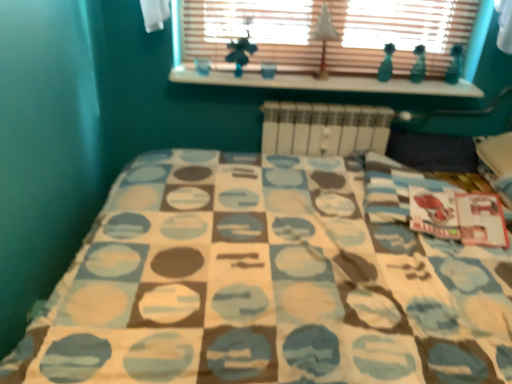
Question: Is white matte radiator at center shorter than white paper tree at upper center?

Choices:
 (A) yes
 (B) no

Answer: (B)

Question: From the image's perspective, would you say white matte radiator at center is positioned over white paper tree at upper center?

Choices:
 (A) yes
 (B) no

Answer: (B)

Question: Are white matte radiator at center and white paper tree at upper center located far from each other?

Choices:
 (A) no
 (B) yes

Answer: (A)

Question: Is the depth of white matte radiator at center less than that of white paper tree at upper center?

Choices:
 (A) no
 (B) yes

Answer: (A)

Question: From a real-world perspective, is white matte radiator at center below white paper tree at upper center?

Choices:
 (A) yes
 (B) no

Answer: (A)

Question: Considering the positions of wooden blinds at upper center and white matte radiator at center in the image, is wooden blinds at upper center bigger or smaller than white matte radiator at center?

Choices:
 (A) big
 (B) small

Answer: (B)

Question: Do you think wooden blinds at upper center is within white matte radiator at center, or outside of it?

Choices:
 (A) outside
 (B) inside

Answer: (A)

Question: In terms of height, does wooden blinds at upper center look taller or shorter compared to white matte radiator at center?

Choices:
 (A) short
 (B) tall

Answer: (A)

Question: From a real-world perspective, is wooden blinds at upper center above or below white matte radiator at center?

Choices:
 (A) above
 (B) below

Answer: (A)

Question: Considering the relative positions of white paper tree at upper center and white painted wood at upper center in the image provided, is white paper tree at upper center to the left or to the right of white painted wood at upper center?

Choices:
 (A) left
 (B) right

Answer: (A)

Question: Is white paper tree at upper center in front of or behind white painted wood at upper center in the image?

Choices:
 (A) front
 (B) behind

Answer: (A)

Question: From their relative heights in the image, would you say white paper tree at upper center is taller or shorter than white painted wood at upper center?

Choices:
 (A) short
 (B) tall

Answer: (B)

Question: From a real-world perspective, is white paper tree at upper center physically located above or below white painted wood at upper center?

Choices:
 (A) above
 (B) below

Answer: (A)

Question: Is white paper tree at upper center in front of or behind wooden blinds at upper center in the image?

Choices:
 (A) behind
 (B) front

Answer: (B)

Question: Choose the correct answer: Is white paper tree at upper center inside wooden blinds at upper center or outside it?

Choices:
 (A) outside
 (B) inside

Answer: (A)